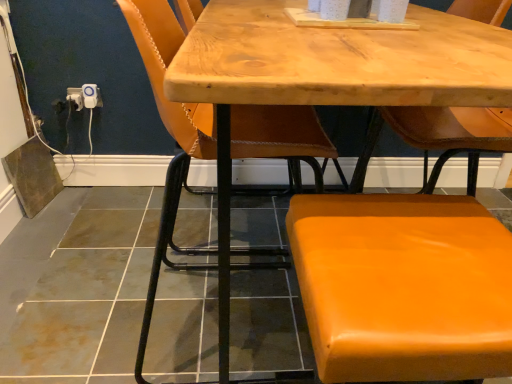
Question: Is white plastic outlet at lower left, arranged as the second electric outlet when viewed from the left, thinner than wooden table at center?

Choices:
 (A) no
 (B) yes

Answer: (B)

Question: From a real-world perspective, is white plastic outlet at lower left, arranged as the second electric outlet when viewed from the left, located higher than wooden table at center?

Choices:
 (A) yes
 (B) no

Answer: (B)

Question: From a real-world perspective, is white plastic outlet at lower left, arranged as the second electric outlet when viewed from the left, under wooden table at center?

Choices:
 (A) yes
 (B) no

Answer: (A)

Question: From the image's perspective, is white plastic outlet at lower left, arranged as the 1th electric outlet when viewed from the right, located above wooden table at center?

Choices:
 (A) yes
 (B) no

Answer: (A)

Question: Does white plastic outlet at lower left, arranged as the second electric outlet when viewed from the left, come behind wooden table at center?

Choices:
 (A) no
 (B) yes

Answer: (B)

Question: Considering the positions of orange leather chair at center, the 1th chair from the left, and white plastic outlet at lower left, arranged as the 1th electric outlet when viewed from the right, in the image, is orange leather chair at center, the 1th chair from the left, bigger or smaller than white plastic outlet at lower left, arranged as the 1th electric outlet when viewed from the right,?

Choices:
 (A) small
 (B) big

Answer: (B)

Question: Considering their positions, is orange leather chair at center, placed as the second chair when sorted from right to left, located in front of or behind white plastic outlet at lower left, arranged as the second electric outlet when viewed from the left?

Choices:
 (A) behind
 (B) front

Answer: (B)

Question: Is point (212, 109) closer or farther from the camera than point (90, 84)?

Choices:
 (A) farther
 (B) closer

Answer: (B)

Question: In the image, is orange leather chair at center, the 1th chair from the left, on the left side or the right side of white plastic outlet at lower left, arranged as the 1th electric outlet when viewed from the right?

Choices:
 (A) left
 (B) right

Answer: (B)

Question: From the image's perspective, is orange leather chair at center, the 1th chair from the left, located above or below orange leather stool at lower right, acting as the first chair starting from the right?

Choices:
 (A) above
 (B) below

Answer: (A)

Question: From a real-world perspective, is orange leather chair at center, the 1th chair from the left, physically located above or below orange leather stool at lower right, acting as the first chair starting from the right?

Choices:
 (A) above
 (B) below

Answer: (A)

Question: Looking at the image, does orange leather chair at center, the 1th chair from the left, seem bigger or smaller compared to orange leather stool at lower right, acting as the first chair starting from the right?

Choices:
 (A) big
 (B) small

Answer: (A)

Question: Do you think orange leather chair at center, the 1th chair from the left, is within orange leather stool at lower right, which ranks as the 2th chair in left-to-right order, or outside of it?

Choices:
 (A) inside
 (B) outside

Answer: (B)

Question: Considering the relative positions of orange leather chair at center, placed as the second chair when sorted from right to left, and wooden table at center in the image provided, is orange leather chair at center, placed as the second chair when sorted from right to left, to the left or to the right of wooden table at center?

Choices:
 (A) left
 (B) right

Answer: (A)

Question: From a real-world perspective, relative to wooden table at center, is orange leather chair at center, placed as the second chair when sorted from right to left, vertically above or below?

Choices:
 (A) above
 (B) below

Answer: (A)